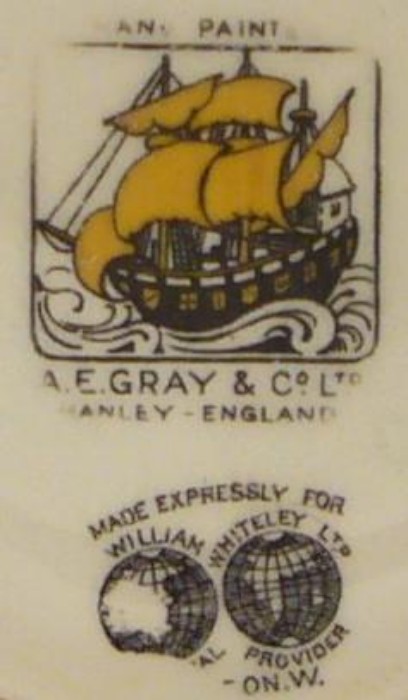
The width and height of the screenshot is (408, 700). Find the location of `bottom right globe`. bottom right globe is located at coordinates (293, 578).